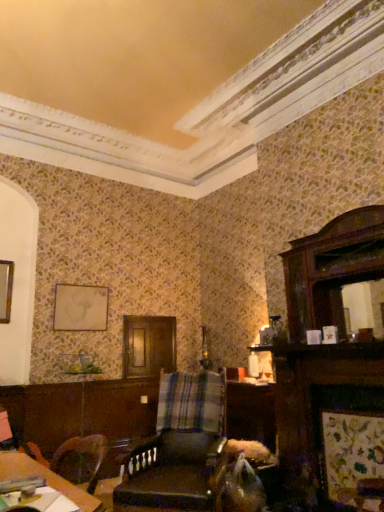
What do you see at coordinates (80, 308) in the screenshot?
I see `matte gold picture frame at upper left` at bounding box center [80, 308].

This screenshot has height=512, width=384. What do you see at coordinates (180, 448) in the screenshot? I see `leather at center` at bounding box center [180, 448].

Locate an element on the screen. wooden table at lower left is located at coordinates click(x=45, y=479).

Based on the photo, is leather at center at the back of matte gold picture frame at upper left?

No, leather at center is not at the back of matte gold picture frame at upper left.

Which point is more distant from viewer, (70, 291) or (192, 430)?

The point (70, 291) is farther.

Which of these two, matte gold picture frame at upper left or leather at center, stands shorter?

Standing shorter between the two is matte gold picture frame at upper left.

Which object is positioned more to the left, matte gold picture frame at upper left or leather at center?

From the viewer's perspective, matte gold picture frame at upper left appears more on the left side.

Considering the points (82, 502) and (65, 298), which point is in front, point (82, 502) or point (65, 298)?

The point (82, 502) is more forward.

Is wooden table at lower left surrounding matte gold picture frame at upper left?

Actually, matte gold picture frame at upper left is outside wooden table at lower left.

Looking at this image, considering the relative sizes of wooden table at lower left and matte gold picture frame at upper left in the image provided, is wooden table at lower left bigger than matte gold picture frame at upper left?

No, wooden table at lower left is not bigger than matte gold picture frame at upper left.

Is wooden table at lower left oriented towards matte gold picture frame at upper left?

No, wooden table at lower left is not oriented towards matte gold picture frame at upper left.

Is leather at center in front of or behind matte gold picture frame at upper left in the image?

leather at center is in front of matte gold picture frame at upper left.

From the image's perspective, is leather at center located above or below matte gold picture frame at upper left?

From the image's perspective, leather at center appears below matte gold picture frame at upper left.

Considering the relative sizes of leather at center and matte gold picture frame at upper left in the image provided, is leather at center smaller than matte gold picture frame at upper left?

No.

Which of these two, leather at center or wooden table at lower left, is wider?

leather at center.

Can you tell me how much leather at center and wooden table at lower left differ in facing direction?

The facing directions of leather at center and wooden table at lower left are 37.7 degrees apart.

Where is `table located above the leather at center (from a real-world perspective)`? Image resolution: width=384 pixels, height=512 pixels. table located above the leather at center (from a real-world perspective) is located at coordinates (45, 479).

Is leather at center oriented towards wooden table at lower left?

Yes, leather at center is facing wooden table at lower left.

Find the location of a particular element. This screenshot has height=512, width=384. picture frame that appears above the wooden table at lower left (from a real-world perspective) is located at coordinates (80, 308).

Is wooden table at lower left surrounded by matte gold picture frame at upper left?

No, wooden table at lower left is not inside matte gold picture frame at upper left.

Between matte gold picture frame at upper left and wooden table at lower left, which one has smaller size?

With smaller size is wooden table at lower left.

Is matte gold picture frame at upper left taller than wooden table at lower left?

Yes, matte gold picture frame at upper left is taller than wooden table at lower left.

Is wooden table at lower left facing towards leather at center?

No, wooden table at lower left is not facing towards leather at center.

Is wooden table at lower left in contact with leather at center?

No, wooden table at lower left is not in contact with leather at center.

Does wooden table at lower left have a greater height compared to leather at center?

No, wooden table at lower left is not taller than leather at center.

Based on the photo, from a real-world perspective, who is located lower, wooden table at lower left or leather at center?

In real-world perspective, leather at center is lower.

Locate an element on the screen. The width and height of the screenshot is (384, 512). chair located on the right of matte gold picture frame at upper left is located at coordinates (180, 448).

Where is `table below the matte gold picture frame at upper left (from the image's perspective)`? This screenshot has height=512, width=384. table below the matte gold picture frame at upper left (from the image's perspective) is located at coordinates (45, 479).

In the scene shown: Considering their positions, is matte gold picture frame at upper left positioned further to leather at center than wooden table at lower left?

Among the two, matte gold picture frame at upper left is located further to leather at center.

Based on their spatial positions, is wooden table at lower left or leather at center further from matte gold picture frame at upper left?

wooden table at lower left is further to matte gold picture frame at upper left.

Estimate the real-world distances between objects in this image. Which object is closer to leather at center, wooden table at lower left or matte gold picture frame at upper left?

Based on the image, wooden table at lower left appears to be nearer to leather at center.

Which object lies nearer to the anchor point wooden table at lower left, matte gold picture frame at upper left or leather at center?

leather at center is positioned closer to the anchor wooden table at lower left.

Based on their spatial positions, is leather at center or wooden table at lower left closer to matte gold picture frame at upper left?

leather at center is positioned closer to the anchor matte gold picture frame at upper left.

Estimate the real-world distances between objects in this image. Which object is further from wooden table at lower left, leather at center or matte gold picture frame at upper left?

matte gold picture frame at upper left.

Where is `chair between wooden table at lower left and matte gold picture frame at upper left from front to back`? This screenshot has height=512, width=384. chair between wooden table at lower left and matte gold picture frame at upper left from front to back is located at coordinates (180, 448).